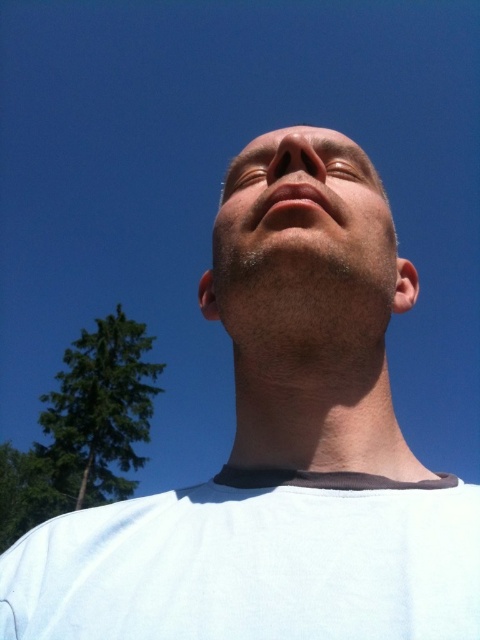
Between white cotton t-shirt at center and smooth skin head at center, which one is positioned lower?

white cotton t-shirt at center

Does white cotton t-shirt at center appear under smooth skin head at center?

Indeed, white cotton t-shirt at center is positioned under smooth skin head at center.

Between point (277, 541) and point (264, 275), which one is positioned in front?

Point (277, 541) is more forward.

The height and width of the screenshot is (640, 480). What are the coordinates of `white cotton t-shirt at center` in the screenshot? It's located at (254, 563).

Which of these two, smooth skin head at center or smooth skin nose at center, stands taller?

With more height is smooth skin head at center.

How distant is smooth skin head at center from smooth skin nose at center?

They are 5.11 inches apart.

Describe the element at coordinates (307, 278) in the screenshot. I see `smooth skin head at center` at that location.

At what (x,y) coordinates should I click in order to perform the action: click on smooth skin head at center. Please return your answer as a coordinate pair (x, y). The width and height of the screenshot is (480, 640). Looking at the image, I should click on (307, 278).

Can you confirm if smooth skin head at center is positioned above smooth skin face at center?

Actually, smooth skin head at center is below smooth skin face at center.

Find the location of a particular element. smooth skin head at center is located at coordinates (307, 278).

At what (x,y) coordinates should I click in order to perform the action: click on smooth skin head at center. Please return your answer as a coordinate pair (x, y). The height and width of the screenshot is (640, 480). Looking at the image, I should click on pyautogui.click(x=307, y=278).

In order to click on smooth skin head at center in this screenshot , I will do `click(307, 278)`.